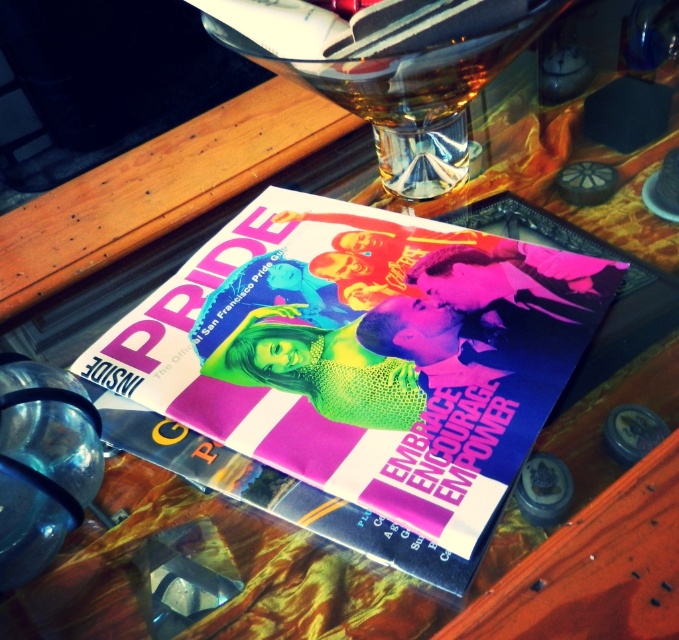
Question: Where is vibrant glossy magazine at center located in relation to transparent plastic bottle at lower left in the image?

Choices:
 (A) left
 (B) right

Answer: (B)

Question: Which point appears farthest from the camera in this image?

Choices:
 (A) (416, 451)
 (B) (5, 403)

Answer: (A)

Question: Is vibrant glossy magazine at center above transparent plastic bottle at lower left?

Choices:
 (A) no
 (B) yes

Answer: (B)

Question: Which object is farther from the camera taking this photo?

Choices:
 (A) vibrant glossy magazine at center
 (B) transparent plastic bottle at lower left

Answer: (B)

Question: Can you confirm if vibrant glossy magazine at center is thinner than transparent plastic bottle at lower left?

Choices:
 (A) no
 (B) yes

Answer: (A)